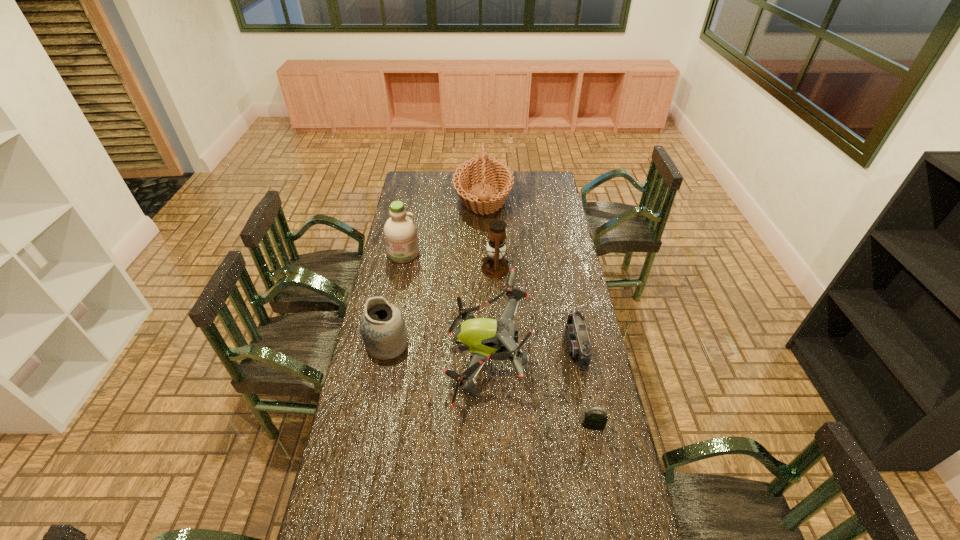
Locate an element on the screen. the farthest object is located at coordinates (485, 170).

Locate an element on the screen. lantern is located at coordinates (495, 265).

The width and height of the screenshot is (960, 540). Find the location of `cleansing agent`. cleansing agent is located at coordinates (400, 232).

This screenshot has width=960, height=540. I want to click on drone, so (x=485, y=338).

Where is `the fifth tallest object`? the fifth tallest object is located at coordinates (382, 325).

The height and width of the screenshot is (540, 960). I want to click on the nearest object, so click(593, 421).

Locate an element on the screen. camcorder is located at coordinates (578, 343).

The width and height of the screenshot is (960, 540). What are the coordinates of `free space located 0.190m on the right of the basket` in the screenshot? It's located at (546, 198).

The width and height of the screenshot is (960, 540). Identify the location of vacant position located on the side of the lantern, there is a wick adjustment knob. (435, 268).

The height and width of the screenshot is (540, 960). Find the location of `free spot located on the side of the lantern, there is a wick adjustment knob`. free spot located on the side of the lantern, there is a wick adjustment knob is located at coordinates (462, 268).